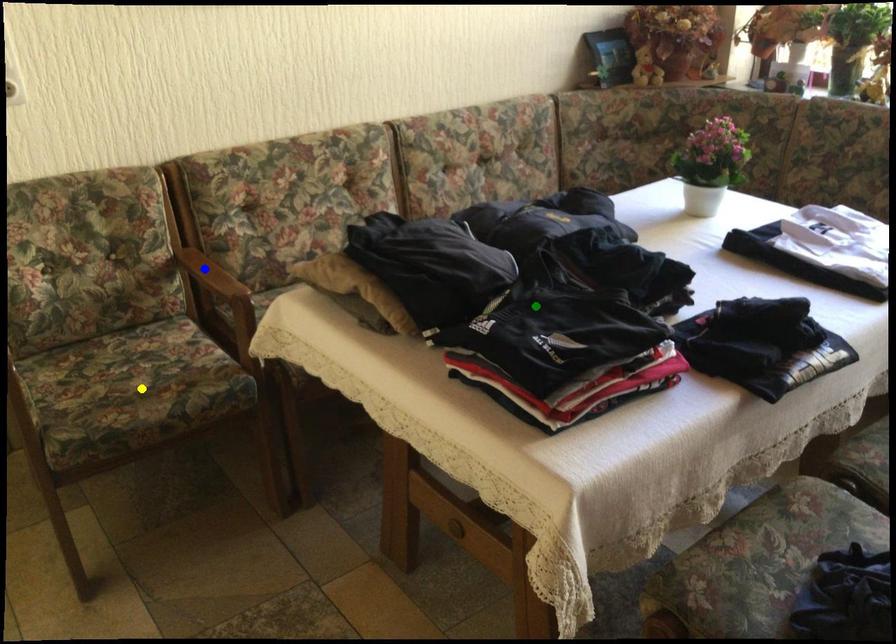
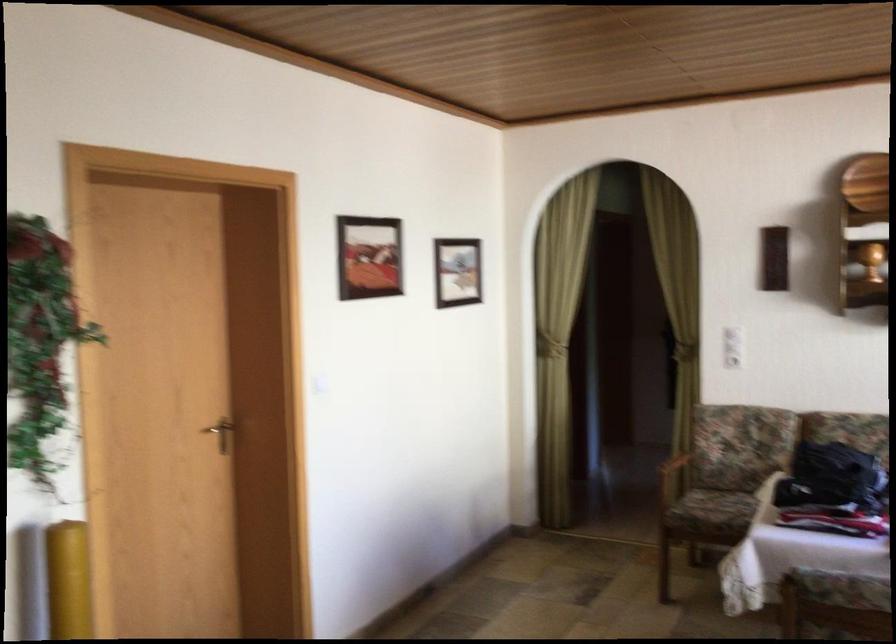
I am providing you with two images of the same scene from different viewpoints. Three points are marked in image1. Which point corresponds to a part or object that is occluded in image2?In image1, three points are marked. Which of them correspond to a part or object that is occluded in image2?Among the three points shown in image1, which one corresponds to a part or object that is no longer visible due to occlusion in image2?

Invisible in image2: blue point.